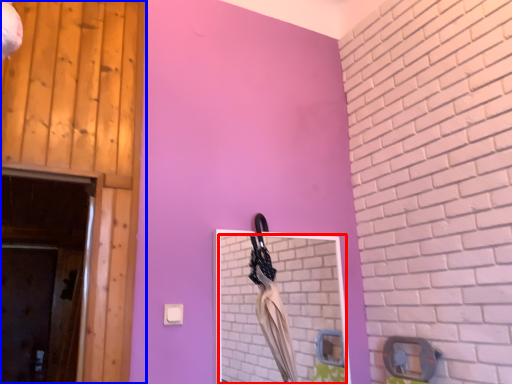
Question: Which of the following is the closest to the observer, mirror (highlighted by a red box) or door (highlighted by a blue box)?

Choices:
 (A) mirror
 (B) door

Answer: (B)